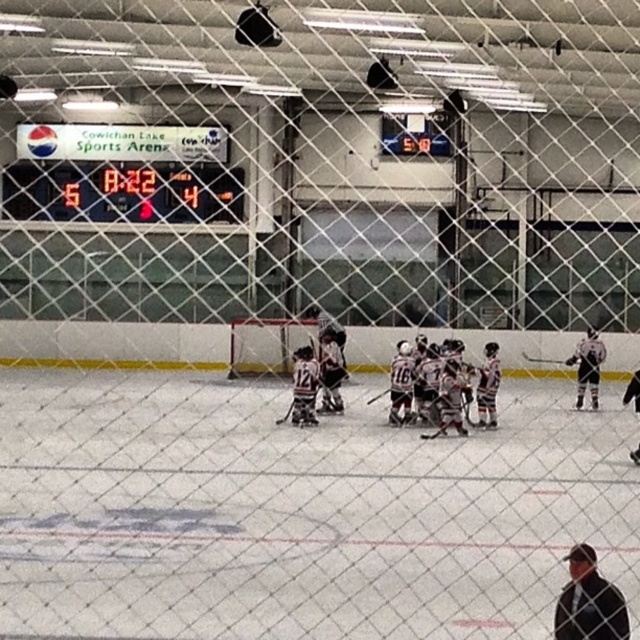
Question: Is white ice at center smaller than digital display scoreboard at upper left?

Choices:
 (A) yes
 (B) no

Answer: (B)

Question: Is white ice at center above digital display scoreboard at upper left?

Choices:
 (A) yes
 (B) no

Answer: (B)

Question: Can you confirm if white ice at center is thinner than digital display scoreboard at upper left?

Choices:
 (A) yes
 (B) no

Answer: (B)